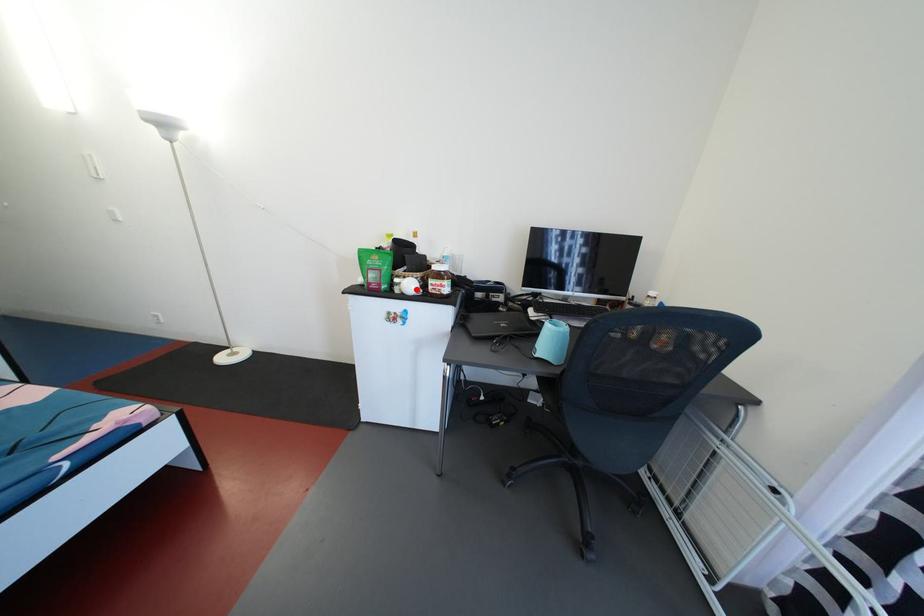
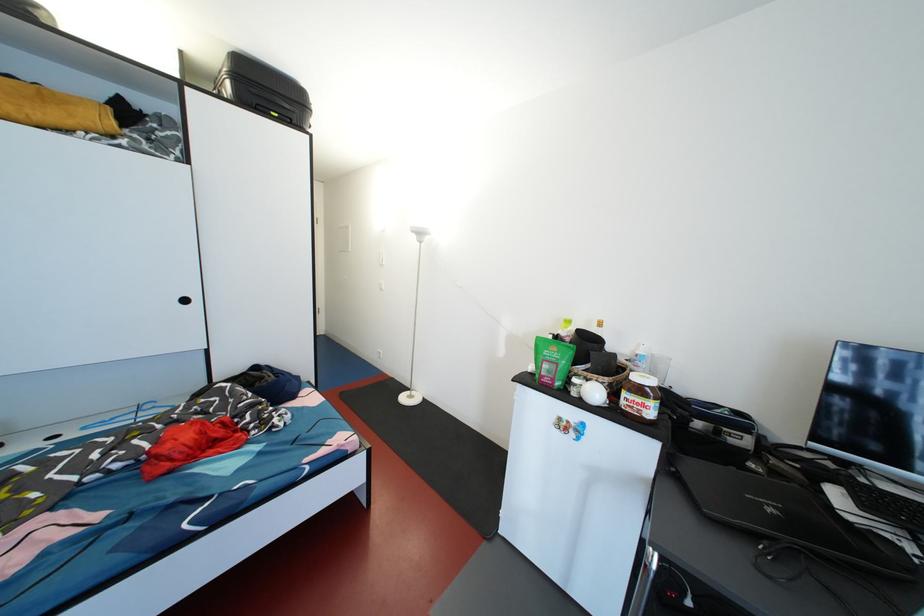
Locate, in the second image, the point that corresponds to the highlighted location in the first image.

(601, 397)